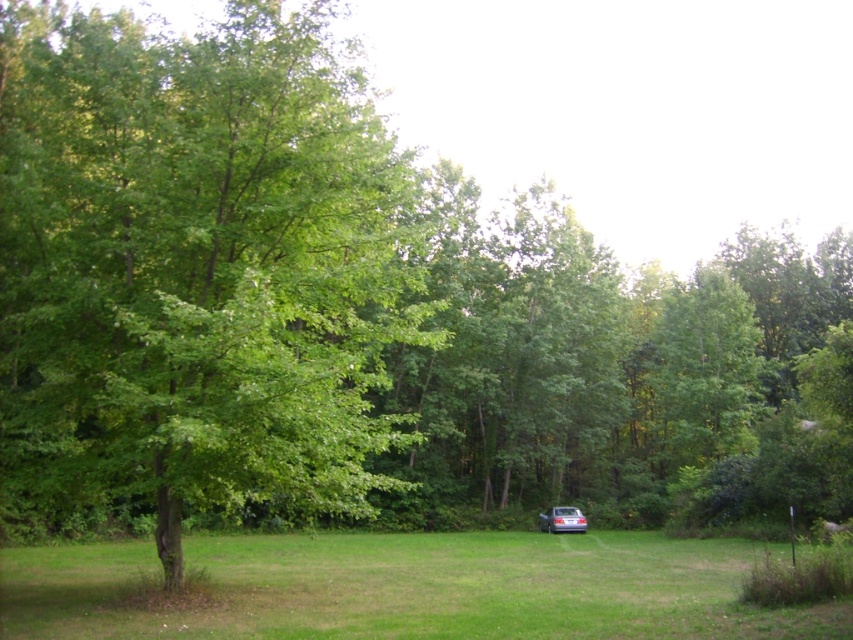
Question: Considering the relative positions of green leafy tree at center and satin silver sedan at center in the image provided, where is green leafy tree at center located with respect to satin silver sedan at center?

Choices:
 (A) above
 (B) below

Answer: (A)

Question: Among these points, which one is farthest from the camera?

Choices:
 (A) (579, 516)
 (B) (276, 163)

Answer: (A)

Question: Is green leafy tree at center to the left of satin silver sedan at center from the viewer's perspective?

Choices:
 (A) yes
 (B) no

Answer: (A)

Question: Which point is closer to the camera taking this photo?

Choices:
 (A) (22, 381)
 (B) (566, 525)

Answer: (A)

Question: Which object is closer to the camera taking this photo?

Choices:
 (A) satin silver sedan at center
 (B) green leafy tree at center

Answer: (B)

Question: Is green leafy tree at center wider than satin silver sedan at center?

Choices:
 (A) no
 (B) yes

Answer: (B)